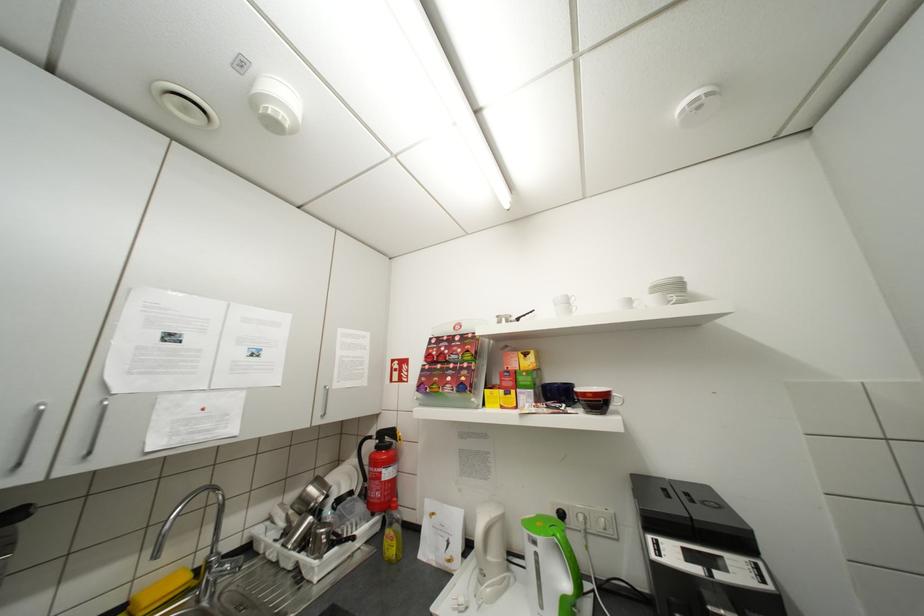
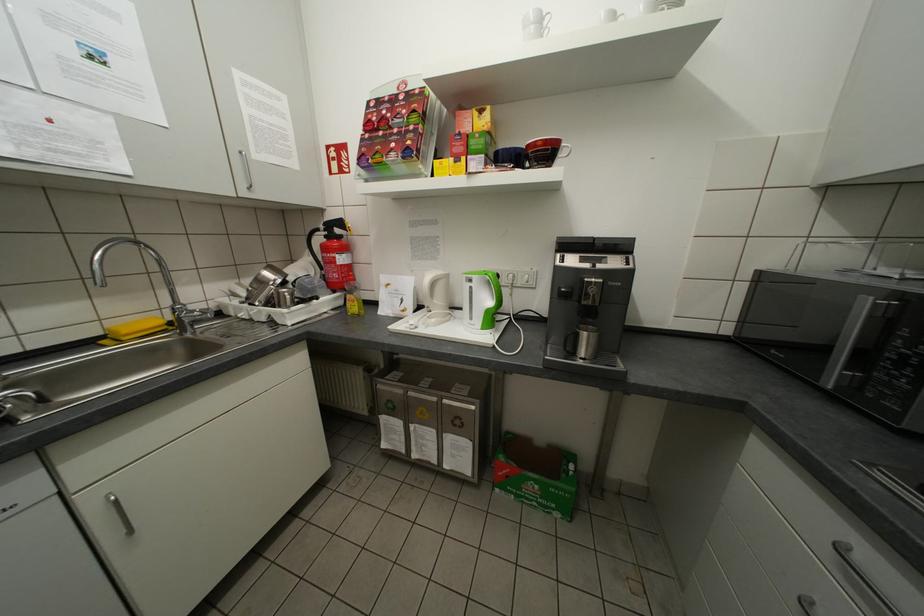
Locate, in the second image, the point that corresponds to the point at 394,543 in the first image.

(357, 305)